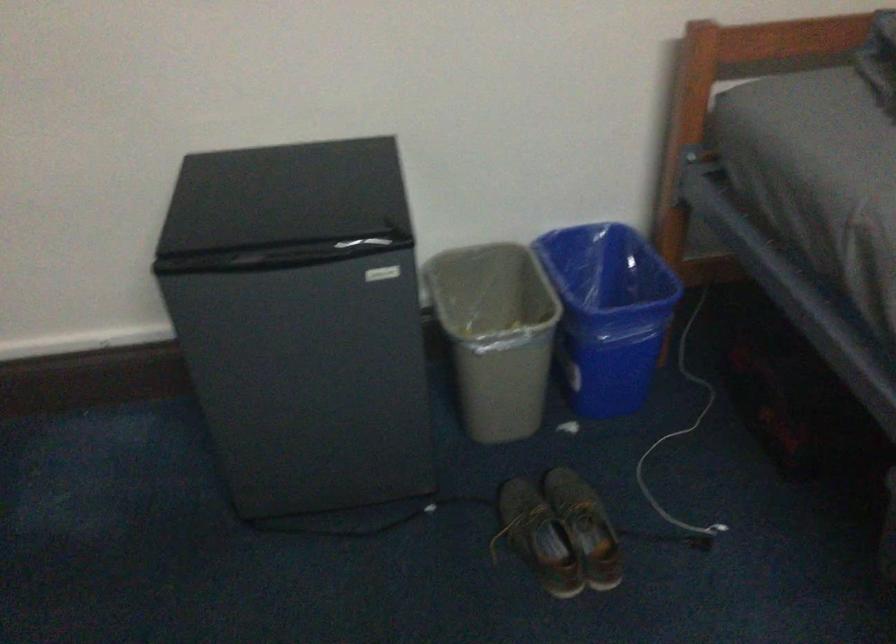
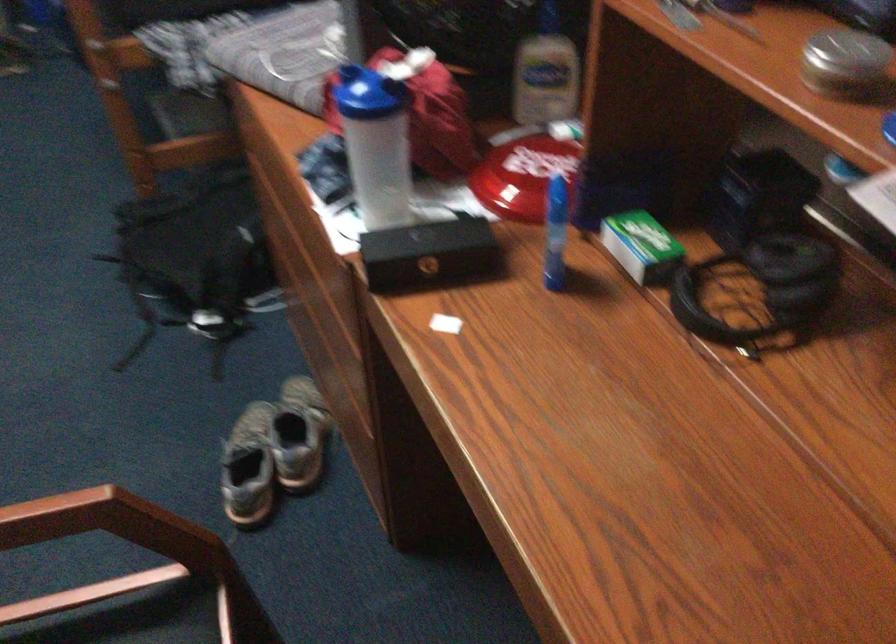
Which direction would the cameraman need to move to produce the second image?

The cameraman walked toward right, backward.